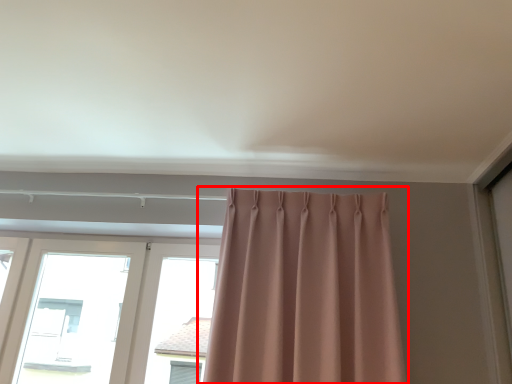
Question: From the image's perspective, what is the correct spatial positioning of curtain (annotated by the red box) in reference to window?

Choices:
 (A) below
 (B) above

Answer: (B)